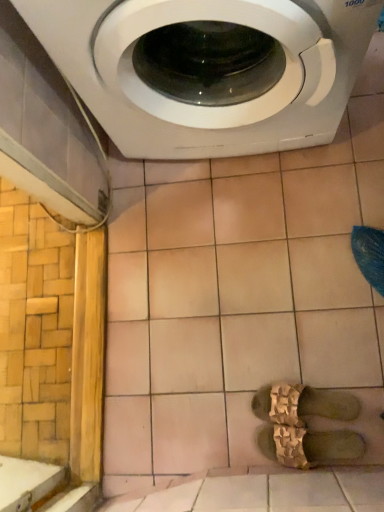
You are a GUI agent. You are given a task and a screenshot of the screen. Output one action in this format:
    pyautogui.click(x=<x>, y=<y>)
    Task: Click on the vacant space to the left of brown textured sandals at center, which is the 2th shoe in top-to-bottom order
    The width and height of the screenshot is (384, 512).
    Given the screenshot: What is the action you would take?
    pyautogui.click(x=232, y=452)